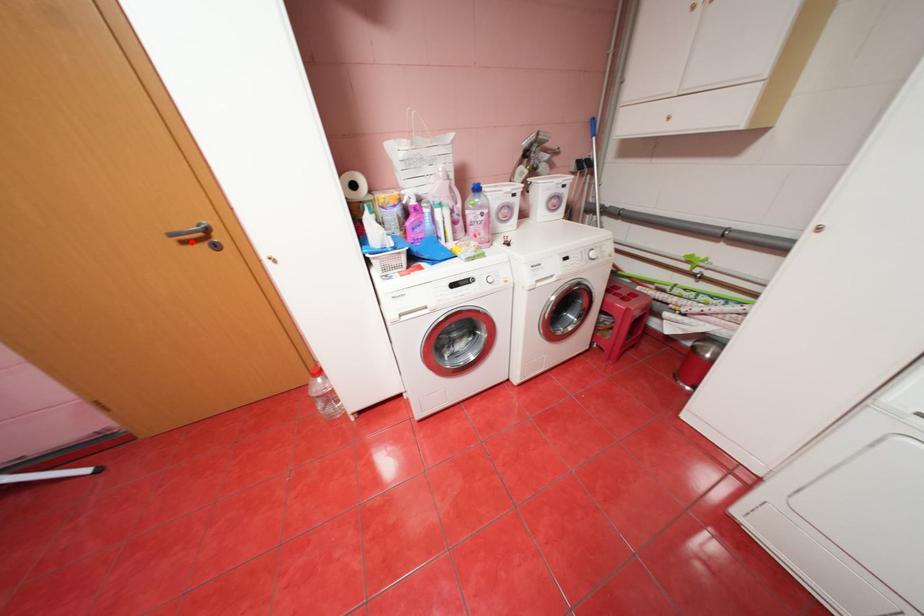
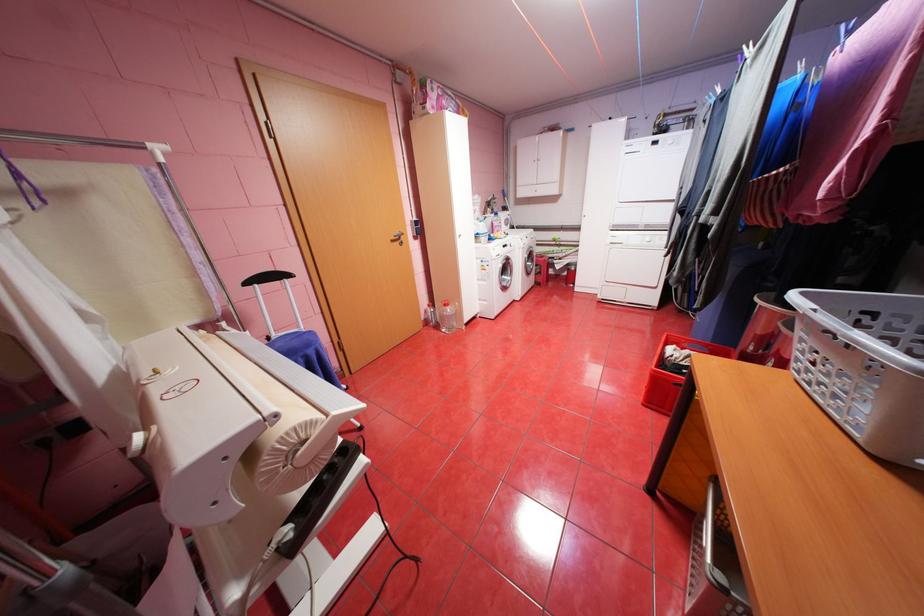
The point at the highlighted location is marked in the first image. Where is the corresponding point in the second image?

(400, 241)